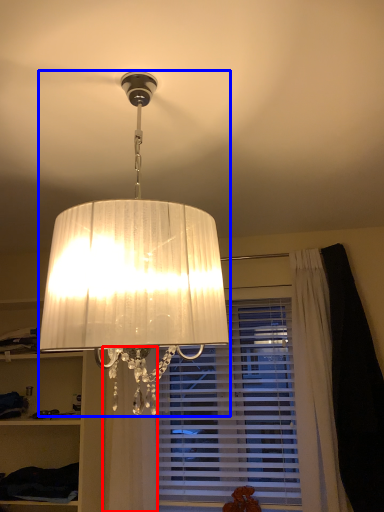
Question: Which of the following is the closest to the observer, curtain (highlighted by a red box) or lamp (highlighted by a blue box)?

Choices:
 (A) curtain
 (B) lamp

Answer: (B)